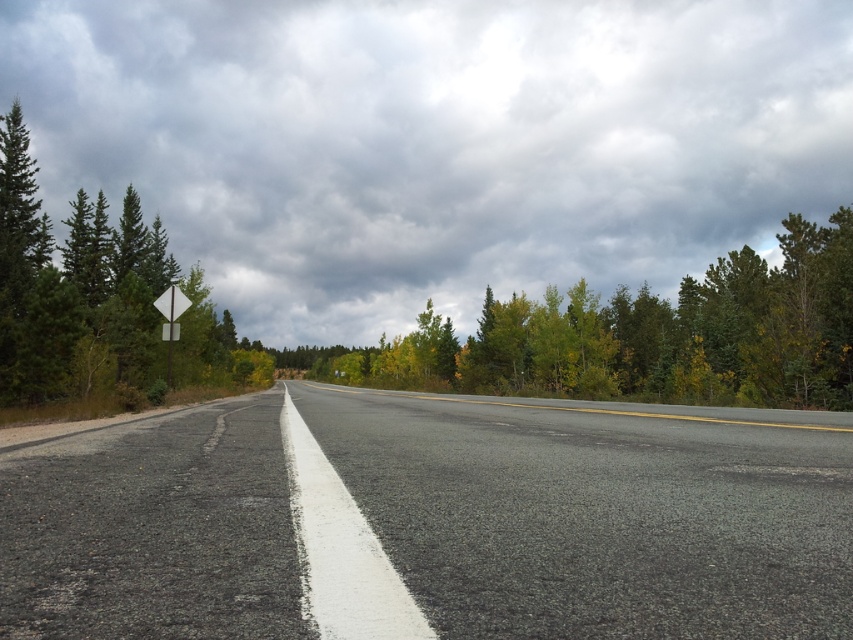
Question: Can you confirm if green leafy trees at upper center is positioned above white plastic diamond-shaped sign at upper left?

Choices:
 (A) yes
 (B) no

Answer: (A)

Question: Is green leafy trees at upper center smaller than white plastic diamond-shaped sign at upper left?

Choices:
 (A) no
 (B) yes

Answer: (A)

Question: Based on their relative distances, which object is nearer to the green leafy trees at upper center?

Choices:
 (A) asphalt road at center
 (B) white plastic diamond-shaped sign at upper left
 (C) cloudy sky at upper center

Answer: (A)

Question: Estimate the real-world distances between objects in this image. Which object is closer to the asphalt road at center?

Choices:
 (A) green leafy trees at upper center
 (B) white plastic diamond-shaped sign at upper left
 (C) cloudy sky at upper center

Answer: (B)

Question: Which of these objects is positioned closest to the cloudy sky at upper center?

Choices:
 (A) asphalt road at center
 (B) green leafy trees at upper center

Answer: (B)

Question: Is green leafy trees at upper center to the left of white plastic diamond-shaped sign at upper left from the viewer's perspective?

Choices:
 (A) yes
 (B) no

Answer: (B)